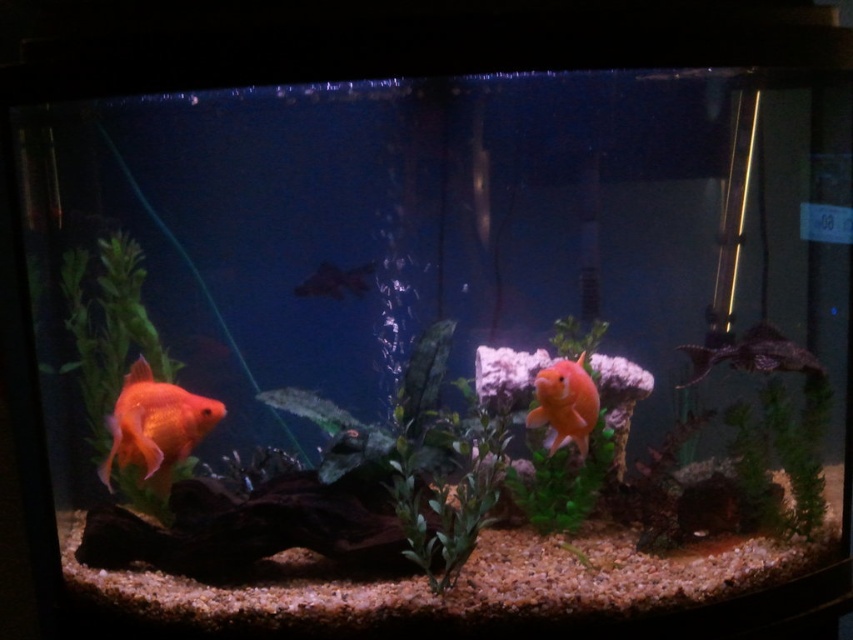
Question: Is green leafy plant at right further to camera compared to shiny silver fish at right?

Choices:
 (A) yes
 (B) no

Answer: (A)

Question: Which point is farther from the camera taking this photo?

Choices:
 (A) (437, 540)
 (B) (198, 436)
 (C) (93, 344)
 (D) (683, 346)

Answer: (D)

Question: Which object is farther from the camera taking this photo?

Choices:
 (A) matte orange goldfish at center
 (B) shiny silver fish at right
 (C) green leafy plant at right

Answer: (C)

Question: Is green leafy plant at left to the right of green leafy plant at center from the viewer's perspective?

Choices:
 (A) no
 (B) yes

Answer: (A)

Question: Can you confirm if green leafy plant at left is positioned above shiny orange fish at lower left?

Choices:
 (A) yes
 (B) no

Answer: (A)

Question: Which object appears farthest from the camera in this image?

Choices:
 (A) matte black fish at center
 (B) matte orange goldfish at center
 (C) green leafy plant at left

Answer: (A)